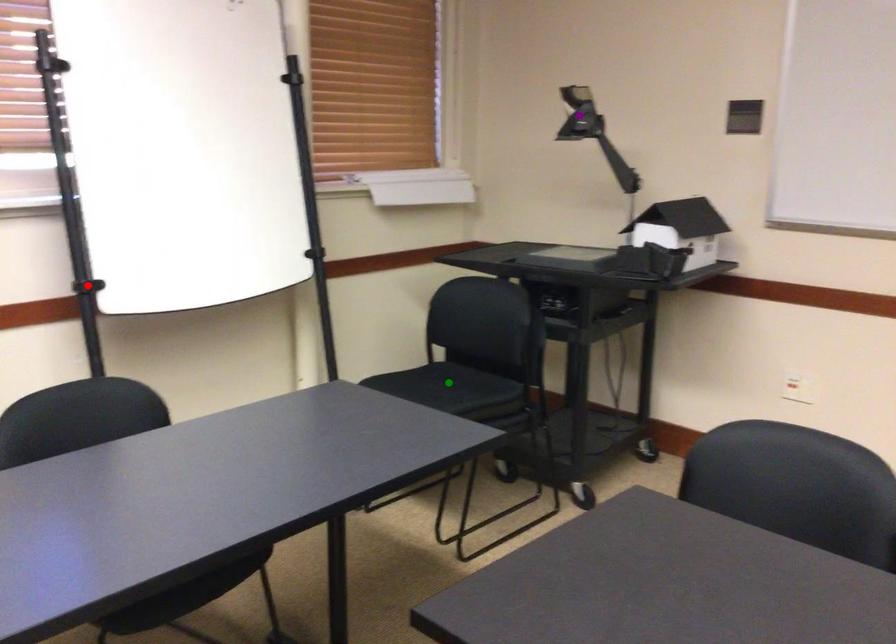
Order these from nearest to farthest:
green point | red point | purple point

red point
green point
purple point